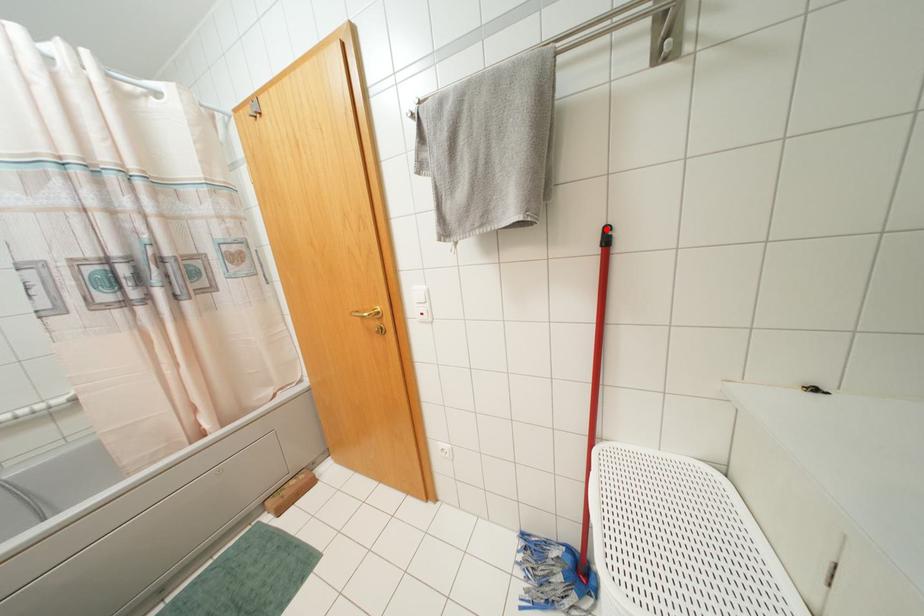
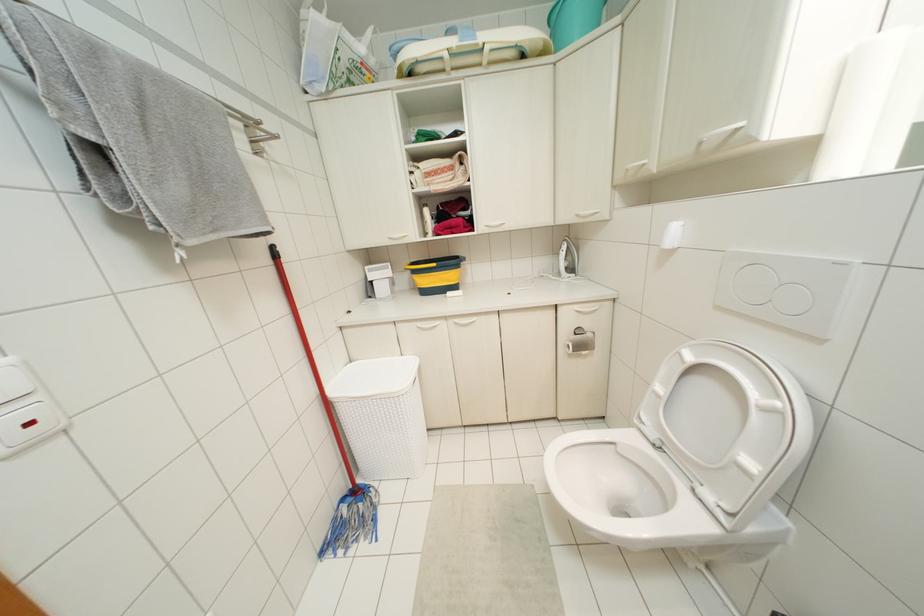
The point at the highlighted location is marked in the first image. Where is the corresponding point in the second image?

(273, 246)